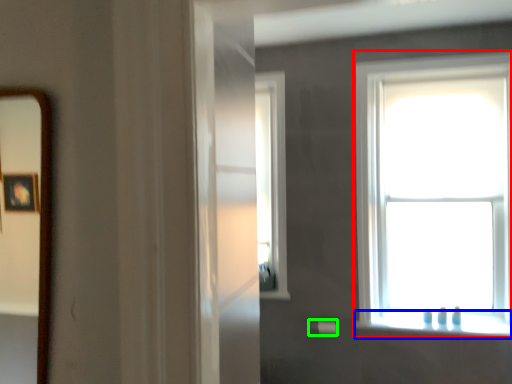
Question: Which object is positioned farthest from window (highlighted by a red box)? Select from window sill (highlighted by a blue box) and towel bar (highlighted by a green box).

Choices:
 (A) window sill
 (B) towel bar

Answer: (B)